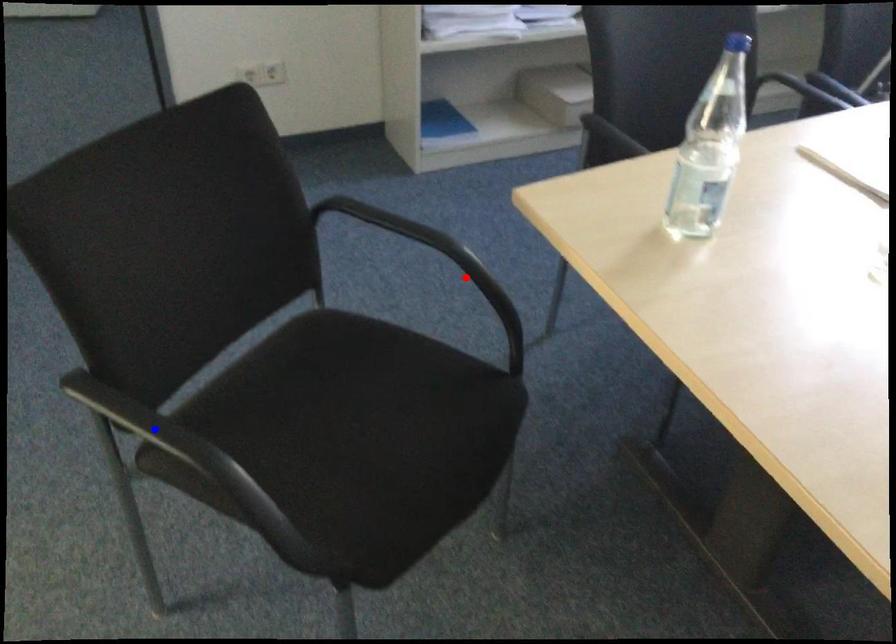
Question: In the image, two points are highlighted. Which point is nearer to the camera? Reply with the corresponding letter.

Choices:
 (A) blue point
 (B) red point

Answer: (A)